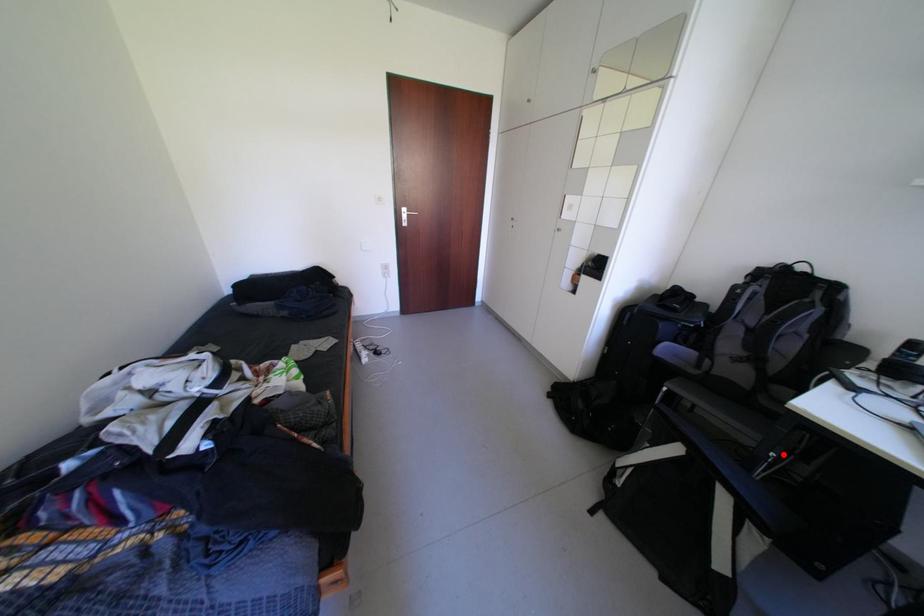
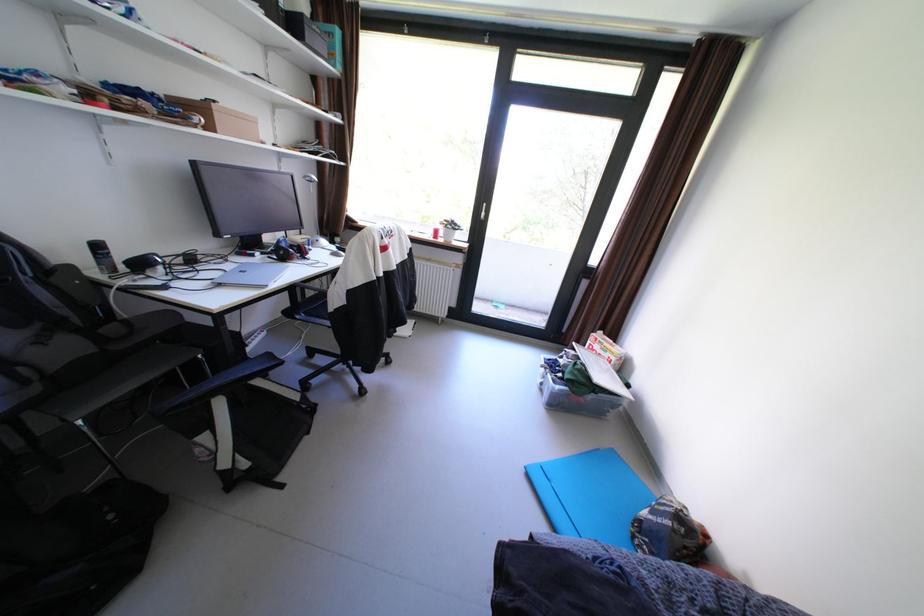
Question: A red point is marked in image1. In image2, is the corresponding 3D point closer to the camera or farther? Reply with the corresponding letter.

Choices:
 (A) The corresponding 3D point is closer.
 (B) The corresponding 3D point is farther.

Answer: (A)